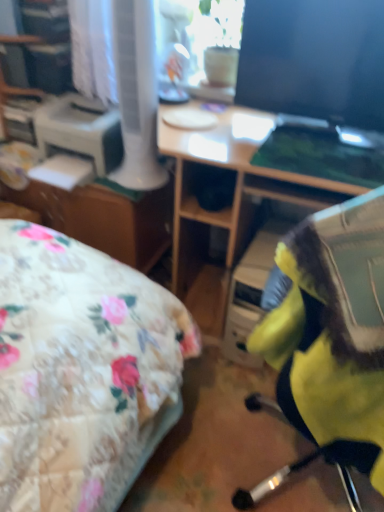
Question: Could you tell me if matte glass window screen at upper center is turned towards white plastic printer at left?

Choices:
 (A) yes
 (B) no

Answer: (B)

Question: Is matte glass window screen at upper center to the right of white plastic printer at left from the viewer's perspective?

Choices:
 (A) yes
 (B) no

Answer: (A)

Question: Does matte glass window screen at upper center appear on the left side of white plastic printer at left?

Choices:
 (A) no
 (B) yes

Answer: (A)

Question: Is matte glass window screen at upper center smaller than white plastic printer at left?

Choices:
 (A) no
 (B) yes

Answer: (B)

Question: Can you confirm if matte glass window screen at upper center is thinner than white plastic printer at left?

Choices:
 (A) yes
 (B) no

Answer: (A)

Question: Is matte glass window screen at upper center shorter than white plastic printer at left?

Choices:
 (A) no
 (B) yes

Answer: (A)

Question: Can you confirm if matte brown file cabinet at center is wider than yellow fabric chair at center?

Choices:
 (A) no
 (B) yes

Answer: (A)

Question: From the image's perspective, does matte brown file cabinet at center appear lower than yellow fabric chair at center?

Choices:
 (A) yes
 (B) no

Answer: (B)

Question: Is matte brown file cabinet at center bigger than yellow fabric chair at center?

Choices:
 (A) no
 (B) yes

Answer: (B)

Question: Is matte brown file cabinet at center not near yellow fabric chair at center?

Choices:
 (A) no
 (B) yes

Answer: (B)

Question: Can you confirm if matte brown file cabinet at center is smaller than yellow fabric chair at center?

Choices:
 (A) yes
 (B) no

Answer: (B)

Question: Is matte brown file cabinet at center in front of yellow fabric chair at center?

Choices:
 (A) no
 (B) yes

Answer: (A)

Question: From the image's perspective, is wooden desk at center below yellow fabric chair at center?

Choices:
 (A) yes
 (B) no

Answer: (B)